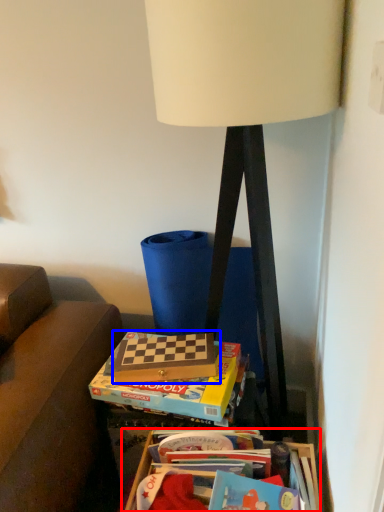
Question: Which of the following is the closest to the observer, table (highlighted by a red box) or paperback book (highlighted by a blue box)?

Choices:
 (A) table
 (B) paperback book

Answer: (A)